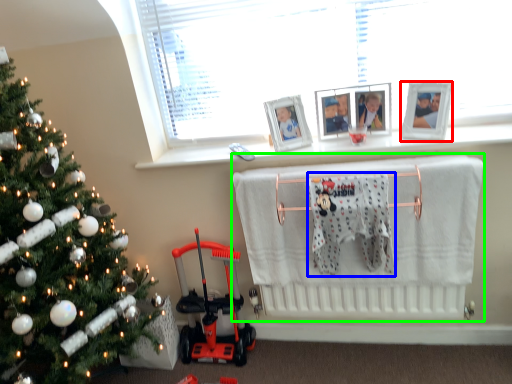
Question: Which object is positioned closest to picture frame (highlighted by a red box)? Select from bath towel (highlighted by a blue box) and infant bed (highlighted by a green box).

Choices:
 (A) bath towel
 (B) infant bed

Answer: (A)